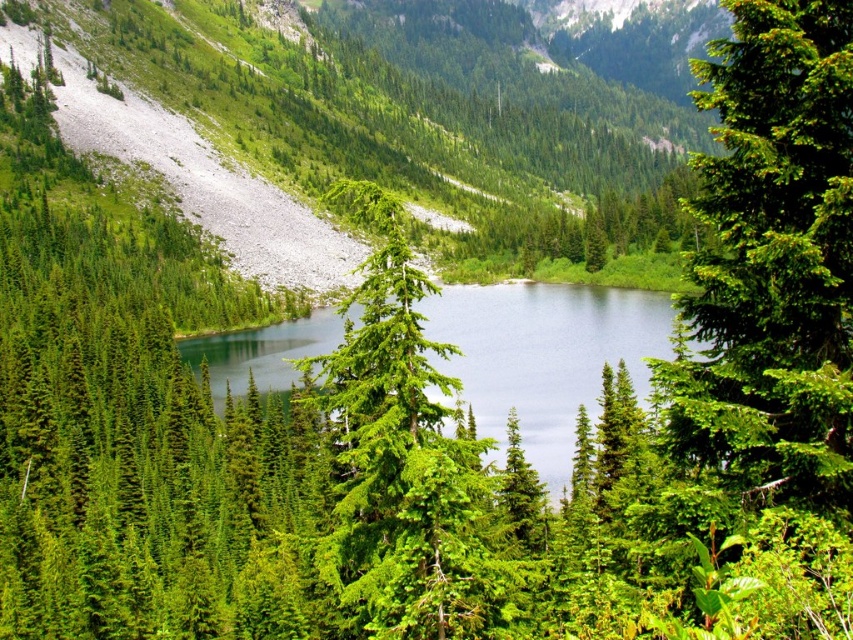
Question: Among these objects, which one is farthest from the camera?

Choices:
 (A) green matte evergreen tree at upper right
 (B) clear blue water at center

Answer: (B)

Question: Which point is closer to the camera taking this photo?

Choices:
 (A) 851,212
 (B) 473,339

Answer: (A)

Question: Is green matte evergreen tree at upper right below clear blue water at center?

Choices:
 (A) yes
 (B) no

Answer: (B)

Question: Is green matte evergreen tree at upper right above clear blue water at center?

Choices:
 (A) yes
 (B) no

Answer: (A)

Question: Does green matte evergreen tree at upper right appear on the left side of clear blue water at center?

Choices:
 (A) yes
 (B) no

Answer: (B)